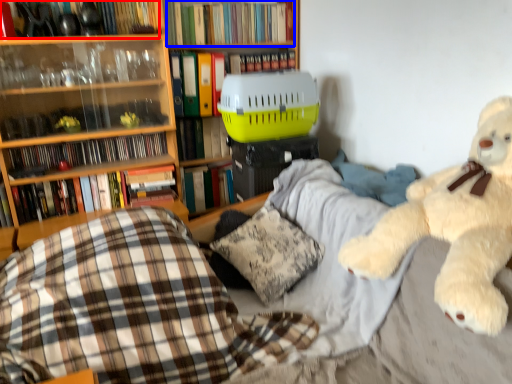
Question: Among these objects, which one is farthest to the camera, book (highlighted by a red box) or book (highlighted by a blue box)?

Choices:
 (A) book
 (B) book

Answer: (B)